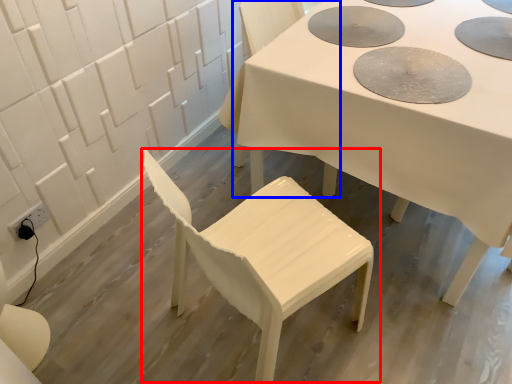
Question: Which point is closer to the camera, chair (highlighted by a red box) or chair (highlighted by a blue box)?

Choices:
 (A) chair
 (B) chair

Answer: (A)